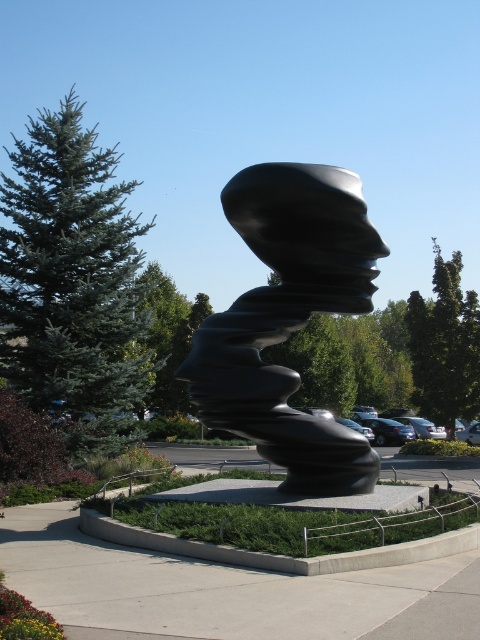
Consider the image. Who is taller, black polished sculpture at center or black polished head at center?

With more height is black polished sculpture at center.

Looking at this image, is black polished sculpture at center smaller than black polished head at center?

Actually, black polished sculpture at center might be larger than black polished head at center.

Locate an element on the screen. The width and height of the screenshot is (480, 640). black polished sculpture at center is located at coordinates point(288,320).